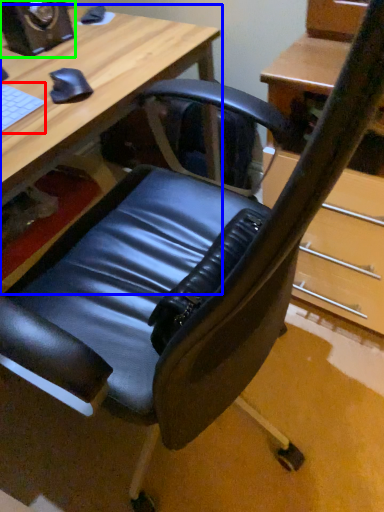
Question: Which is farther away from laptop keyboard (highlighted by a red box)? desk (highlighted by a blue box) or speaker (highlighted by a green box)?

Choices:
 (A) desk
 (B) speaker

Answer: (B)